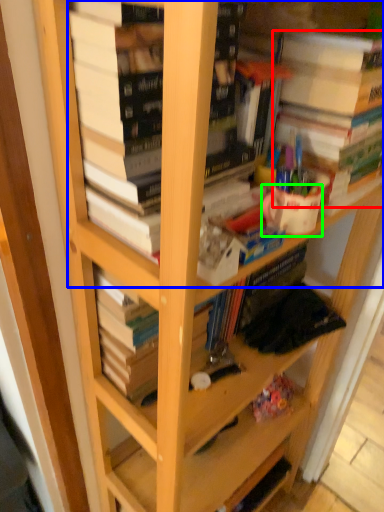
Question: Estimate the real-world distances between objects in this image. Which object is farther from book (highlighted by a red box), book (highlighted by a blue box) or coffee cup (highlighted by a green box)?

Choices:
 (A) book
 (B) coffee cup

Answer: (A)